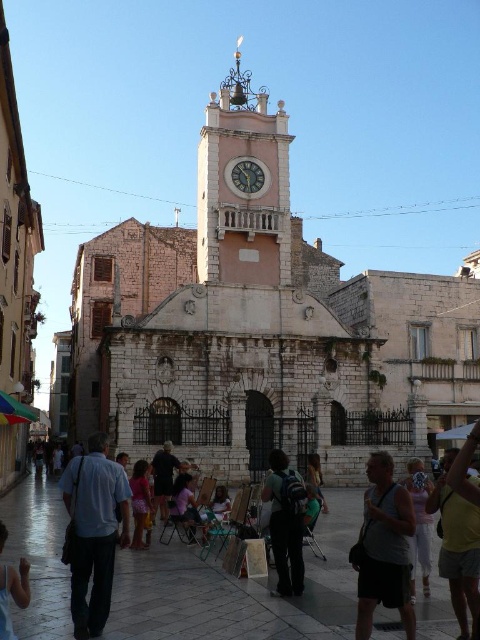
How much distance is there between light blue cotton shirt at lower left and yellow cotton shirt at lower right?

They are 14.68 meters apart.

What do you see at coordinates (95, 531) in the screenshot? I see `light blue cotton shirt at lower left` at bounding box center [95, 531].

Is point (67, 499) positioned before point (462, 556)?

That is False.

I want to click on light blue cotton shirt at lower left, so click(x=95, y=531).

Does gold metallic clock at center appear under denim jacket at center?

Incorrect, gold metallic clock at center is not positioned below denim jacket at center.

Does point (249, 188) come behind point (323, 508)?

Yes, point (249, 188) is behind point (323, 508).

The image size is (480, 640). I want to click on gold metallic clock at center, so click(x=247, y=177).

Can you confirm if light pink stone clock tower at center is positioned below gray fabric tank top at center?

No, light pink stone clock tower at center is not below gray fabric tank top at center.

Is point (271, 186) closer to camera compared to point (360, 600)?

No, it is not.

Identify the location of light pink stone clock tower at center. (242, 186).